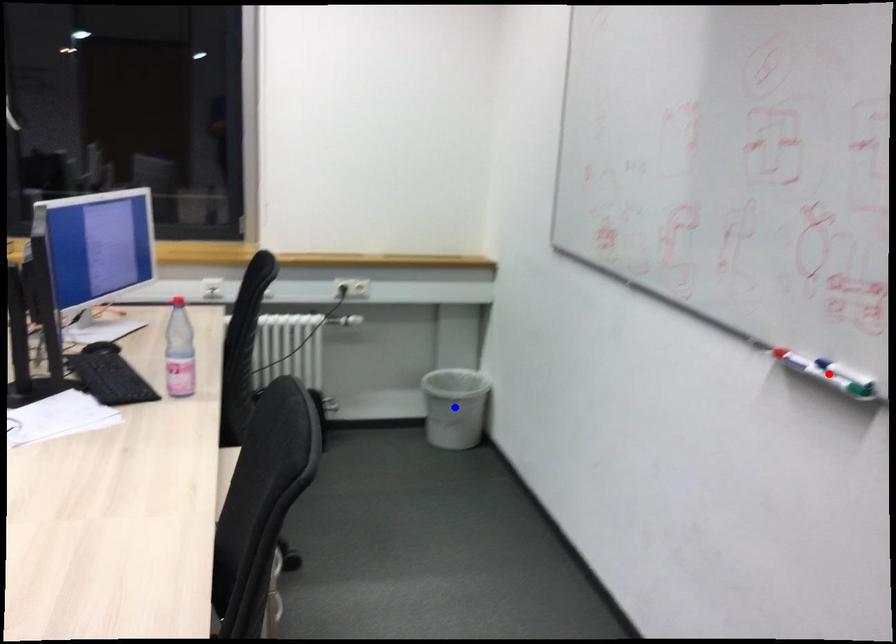
Question: Two points are marked on the image. Which point is closer to the camera?

Choices:
 (A) Blue point is closer.
 (B) Red point is closer.

Answer: (B)